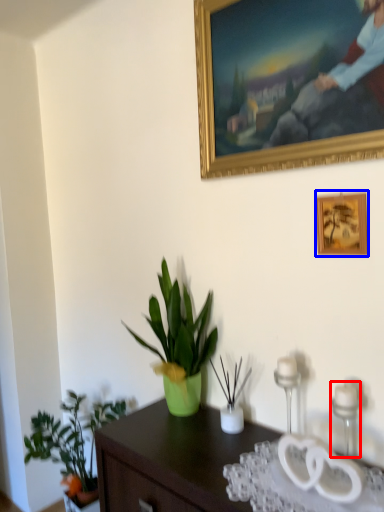
Question: Which of the following is the closest to the observer, candle holder (highlighted by a red box) or picture frame (highlighted by a blue box)?

Choices:
 (A) candle holder
 (B) picture frame

Answer: (A)